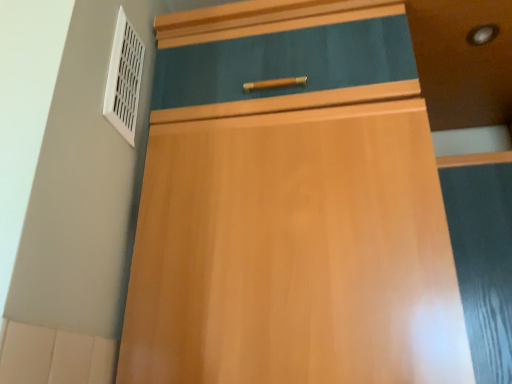
What is the approximate width of white plastic vent at upper left?

The width of white plastic vent at upper left is 0.85 inches.

Where is `white plastic vent at upper left`? The height and width of the screenshot is (384, 512). white plastic vent at upper left is located at coordinates (124, 78).

Describe the element at coordinates (124, 78) in the screenshot. I see `white plastic vent at upper left` at that location.

Locate an element on the screen. This screenshot has width=512, height=384. matte black screen door at right is located at coordinates (482, 255).

This screenshot has width=512, height=384. What do you see at coordinates (482, 255) in the screenshot? I see `matte black screen door at right` at bounding box center [482, 255].

The width and height of the screenshot is (512, 384). Identify the location of white plastic vent at upper left. (124, 78).

Considering the positions of objects white plastic vent at upper left and matte black screen door at right in the image provided, who is more to the left, white plastic vent at upper left or matte black screen door at right?

white plastic vent at upper left is more to the left.

Does white plastic vent at upper left lie behind matte black screen door at right?

Yes, white plastic vent at upper left is behind matte black screen door at right.

Does point (126, 99) lie behind point (510, 169)?

No, it is not.

Based on the photo, from the image's perspective, which is above, white plastic vent at upper left or matte black screen door at right?

white plastic vent at upper left is shown above in the image.

From a real-world perspective, is white plastic vent at upper left positioned above or below matte black screen door at right?

Clearly, from a real-world perspective, white plastic vent at upper left is above matte black screen door at right.

Considering the relative sizes of white plastic vent at upper left and matte black screen door at right in the image provided, is white plastic vent at upper left thinner than matte black screen door at right?

Yes, white plastic vent at upper left is thinner than matte black screen door at right.

Looking at this image, does white plastic vent at upper left have a lesser height compared to matte black screen door at right?

Correct, white plastic vent at upper left is not as tall as matte black screen door at right.

In the scene shown: Who is smaller, white plastic vent at upper left or matte black screen door at right?

With smaller size is white plastic vent at upper left.

Is matte black screen door at right inside white plastic vent at upper left?

That's incorrect, matte black screen door at right is not inside white plastic vent at upper left.

Is white plastic vent at upper left next to matte black screen door at right?

white plastic vent at upper left and matte black screen door at right are clearly separated.

Is white plastic vent at upper left oriented away from matte black screen door at right?

No, matte black screen door at right is not at the back of white plastic vent at upper left.

The image size is (512, 384). Identify the location of screen door below the white plastic vent at upper left (from the image's perspective). (482, 255).

Considering the relative positions of matte black screen door at right and white plastic vent at upper left in the image provided, is matte black screen door at right to the left of white plastic vent at upper left from the viewer's perspective?

In fact, matte black screen door at right is to the right of white plastic vent at upper left.

Looking at this image, is the position of matte black screen door at right less distant than that of white plastic vent at upper left?

Yes, matte black screen door at right is closer to the camera.

Considering the points (495, 245) and (109, 74), which point is in front, point (495, 245) or point (109, 74)?

Positioned in front is point (109, 74).

From the image's perspective, between matte black screen door at right and white plastic vent at upper left, which one is located above?

white plastic vent at upper left appears higher in the image.

From a real-world perspective, which object stands above the other?

From a 3D spatial view, white plastic vent at upper left is above.

Between matte black screen door at right and white plastic vent at upper left, which one has smaller width?

white plastic vent at upper left.

Is matte black screen door at right taller than white plastic vent at upper left?

Yes.

Which of these two, matte black screen door at right or white plastic vent at upper left, is smaller?

white plastic vent at upper left.

Would you say white plastic vent at upper left is part of matte black screen door at right's contents?

No, white plastic vent at upper left is not inside matte black screen door at right.

Can you see matte black screen door at right touching white plastic vent at upper left?

matte black screen door at right and white plastic vent at upper left are clearly separated.

Is matte black screen door at right looking in the opposite direction of white plastic vent at upper left?

No, white plastic vent at upper left is not at the back of matte black screen door at right.

How different are the orientations of matte black screen door at right and white plastic vent at upper left in degrees?

matte black screen door at right and white plastic vent at upper left are facing 90 degrees away from each other.

At what (x,y) coordinates should I click in order to perform the action: click on air conditioning behind the matte black screen door at right. Please return your answer as a coordinate pair (x, y). The image size is (512, 384). Looking at the image, I should click on (124, 78).

This screenshot has height=384, width=512. I want to click on screen door in front of the white plastic vent at upper left, so click(x=482, y=255).

This screenshot has width=512, height=384. I want to click on screen door on the right of white plastic vent at upper left, so click(482, 255).